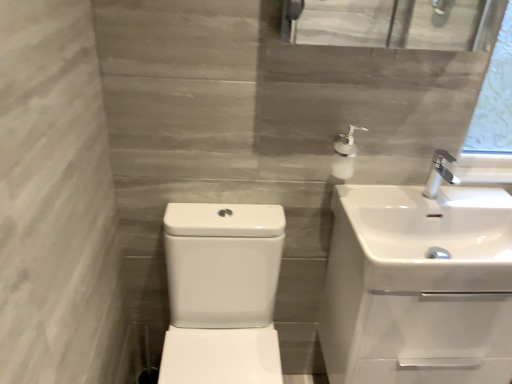
Question: Considering the relative sizes of white glossy soap dispenser at upper right and white glossy sink at center, which is the third sink from right to left, in the image provided, is white glossy soap dispenser at upper right smaller than white glossy sink at center, which is the third sink from right to left,?

Choices:
 (A) yes
 (B) no

Answer: (A)

Question: From the image's perspective, is white glossy soap dispenser at upper right located above white glossy sink at center, which is the third sink from right to left?

Choices:
 (A) yes
 (B) no

Answer: (A)

Question: Considering the relative sizes of white glossy soap dispenser at upper right and white glossy sink at center, which is counted as the first sink, starting from the left, in the image provided, is white glossy soap dispenser at upper right thinner than white glossy sink at center, which is counted as the first sink, starting from the left,?

Choices:
 (A) no
 (B) yes

Answer: (B)

Question: Is white glossy sink at center, which is the third sink from right to left, inside white glossy soap dispenser at upper right?

Choices:
 (A) no
 (B) yes

Answer: (A)

Question: Would you say white glossy soap dispenser at upper right is a long distance from white glossy sink at center, which is the third sink from right to left?

Choices:
 (A) yes
 (B) no

Answer: (B)

Question: Is white glossy sink at center, which is counted as the first sink, starting from the left, in front of or behind white glossy sink at right, the second sink positioned from the right, in the image?

Choices:
 (A) front
 (B) behind

Answer: (A)

Question: From the image's perspective, is white glossy sink at center, which is counted as the first sink, starting from the left, above or below white glossy sink at right, which is counted as the second sink, starting from the left?

Choices:
 (A) below
 (B) above

Answer: (A)

Question: Considering the positions of white glossy sink at center, which is counted as the first sink, starting from the left, and white glossy sink at right, which is counted as the second sink, starting from the left, in the image, is white glossy sink at center, which is counted as the first sink, starting from the left, bigger or smaller than white glossy sink at right, which is counted as the second sink, starting from the left,?

Choices:
 (A) big
 (B) small

Answer: (A)

Question: Is white glossy sink at center, which is the third sink from right to left, to the left or to the right of white glossy sink at right, which is counted as the second sink, starting from the left, in the image?

Choices:
 (A) left
 (B) right

Answer: (A)

Question: From the image's perspective, is white glossy sink at upper right, which ranks as the 3th sink in left-to-right order, positioned above or below white glossy sink at right, which is counted as the second sink, starting from the left?

Choices:
 (A) below
 (B) above

Answer: (B)

Question: Is point (385, 205) closer or farther from the camera than point (395, 281)?

Choices:
 (A) closer
 (B) farther

Answer: (B)

Question: Is white glossy sink at upper right, which ranks as the 3th sink in left-to-right order, wider or thinner than white glossy sink at right, which is counted as the second sink, starting from the left?

Choices:
 (A) thin
 (B) wide

Answer: (B)

Question: In terms of height, does white glossy sink at upper right, which is the 1th sink in right-to-left order, look taller or shorter compared to white glossy sink at right, the second sink positioned from the right?

Choices:
 (A) tall
 (B) short

Answer: (B)

Question: From the image's perspective, is white glossy soap dispenser at upper right located above or below white glossy sink at upper right, which is the 1th sink in right-to-left order?

Choices:
 (A) below
 (B) above

Answer: (B)

Question: Is white glossy soap dispenser at upper right bigger or smaller than white glossy sink at upper right, which is the 1th sink in right-to-left order?

Choices:
 (A) big
 (B) small

Answer: (B)